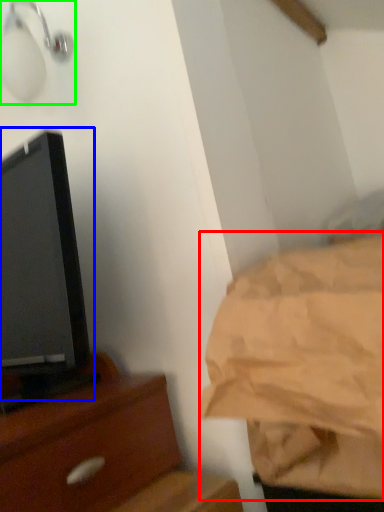
Question: Which object is positioned closest to sheet (highlighted by a red box)? Select from tv show (highlighted by a blue box) and light fixture (highlighted by a green box).

Choices:
 (A) tv show
 (B) light fixture

Answer: (A)